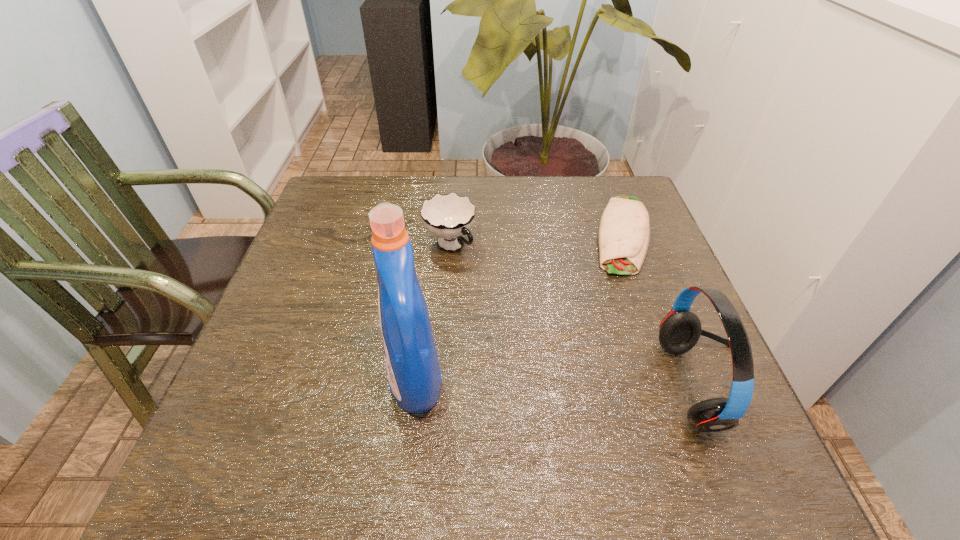
Locate an element on the screen. the tallest object is located at coordinates (414, 376).

At what (x,y) coordinates should I click in order to perform the action: click on the third shortest object. Please return your answer as a coordinate pair (x, y). Image resolution: width=960 pixels, height=540 pixels. Looking at the image, I should click on (680, 330).

You are a GUI agent. You are given a task and a screenshot of the screen. Output one action in this format:
    pyautogui.click(x=<x>, y=<y>)
    Task: Click on the third tallest object
    
    Given the screenshot: What is the action you would take?
    pyautogui.click(x=450, y=216)

I want to click on burrito, so click(x=624, y=232).

You are a GUI agent. You are given a task and a screenshot of the screen. Output one action in this format:
    pyautogui.click(x=<x>, y=<y>)
    Task: Click on the vacant space located 0.080m on the label of the tallest object
    The height and width of the screenshot is (540, 960).
    Given the screenshot: What is the action you would take?
    pyautogui.click(x=345, y=381)

The width and height of the screenshot is (960, 540). Find the location of `free point located 0.170m on the label of the tallest object`. free point located 0.170m on the label of the tallest object is located at coordinates (296, 381).

Where is `free space located 0.060m on the label of the tallest object`? free space located 0.060m on the label of the tallest object is located at coordinates (355, 381).

The width and height of the screenshot is (960, 540). What are the coordinates of `free point located on the side of the cup with the handle` in the screenshot? It's located at (487, 283).

You are a GUI agent. You are given a task and a screenshot of the screen. Output one action in this format:
    pyautogui.click(x=<x>, y=<y>)
    Task: Click on the free space located on the side of the cup with the handle
    
    Given the screenshot: What is the action you would take?
    pyautogui.click(x=482, y=278)

The image size is (960, 540). I want to click on vacant position located 0.240m on the side of the cup with the handle, so click(530, 324).